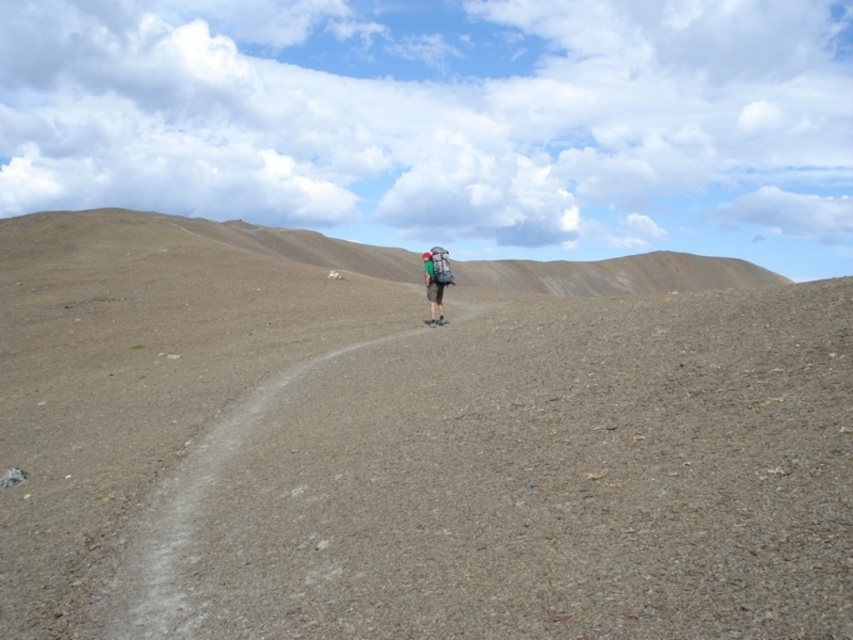
You are standing at the starting point of your hike and see the brown gravel path at center. Based on the coordinates provided, in which direction should you walk to stay on the path?

The brown gravel path at center is located at coordinates point (x=453, y=472), so you should walk towards the center of the image to stay on the path.

You are a hiker who wants to place your green fabric backpack at center on the ground next to the brown gravel path at center. Given that the path is only 3 feet wide, can you safely place the backpack on the side of the path without it being on the path itself?

The brown gravel path at center and green fabric backpack at center are 69.92 feet apart. Since the path is 3 feet wide, placing the backpack next to it would require at least 3 feet of space. The distance between them is sufficient, so yes, you can safely place the backpack on the side of the path without it being on the path itself.